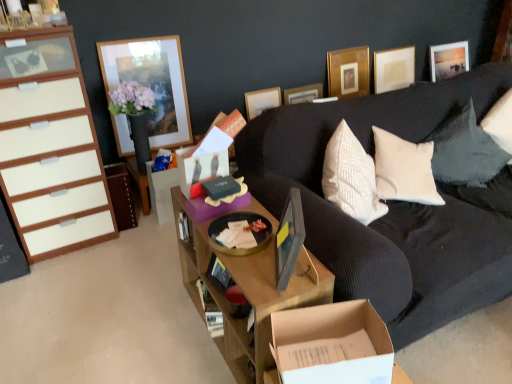
Question: Does matte gray picture frame at center, which ranks as the 6th picture frame in back-to-front order, have a larger size compared to gold metallic picture frame at upper center, acting as the 4th picture frame starting from the front?

Choices:
 (A) no
 (B) yes

Answer: (A)

Question: From the image's perspective, is matte gray picture frame at center, the 1th picture frame in the front-to-back sequence, located above gold metallic picture frame at upper center, which is the third picture frame from back to front?

Choices:
 (A) yes
 (B) no

Answer: (B)

Question: Is matte gray picture frame at center, which ranks as the 6th picture frame in back-to-front order, in contact with gold metallic picture frame at upper center, which is the third picture frame from back to front?

Choices:
 (A) no
 (B) yes

Answer: (A)

Question: Is matte gray picture frame at center, the 3th picture frame when ordered from left to right, far from gold metallic picture frame at upper center, the fourth picture frame when ordered from left to right?

Choices:
 (A) no
 (B) yes

Answer: (B)

Question: Does matte gray picture frame at center, the fourth picture frame in the right-to-left sequence, have a lesser height compared to gold metallic picture frame at upper center, which is the third picture frame from back to front?

Choices:
 (A) yes
 (B) no

Answer: (A)

Question: From the image's perspective, would you say matte gray picture frame at center, the 1th picture frame in the front-to-back sequence, is shown under gold metallic picture frame at upper center, which is the third picture frame from back to front?

Choices:
 (A) no
 (B) yes

Answer: (B)

Question: Is white glossy cabinet at left, the 1th cabinetry when ordered from left to right, taller than wooden picture frame at upper left, marked as the first picture frame in a left-to-right arrangement?

Choices:
 (A) yes
 (B) no

Answer: (A)

Question: From the image's perspective, is white glossy cabinet at left, acting as the second cabinetry starting from the right, on top of wooden picture frame at upper left, acting as the 6th picture frame starting from the right?

Choices:
 (A) yes
 (B) no

Answer: (B)

Question: From a real-world perspective, does white glossy cabinet at left, acting as the second cabinetry starting from the right, sit lower than wooden picture frame at upper left, acting as the 6th picture frame starting from the right?

Choices:
 (A) yes
 (B) no

Answer: (A)

Question: Considering the relative sizes of white glossy cabinet at left, the 1th cabinetry when ordered from left to right, and wooden picture frame at upper left, marked as the first picture frame in a left-to-right arrangement, in the image provided, is white glossy cabinet at left, the 1th cabinetry when ordered from left to right, smaller than wooden picture frame at upper left, marked as the first picture frame in a left-to-right arrangement,?

Choices:
 (A) no
 (B) yes

Answer: (A)

Question: Is white glossy cabinet at left, acting as the second cabinetry starting from the right, positioned beyond the bounds of wooden picture frame at upper left, acting as the 6th picture frame starting from the right?

Choices:
 (A) yes
 (B) no

Answer: (A)

Question: Can you confirm if white glossy cabinet at left, acting as the second cabinetry starting from the right, is wider than wooden picture frame at upper left, marked as the first picture frame in a left-to-right arrangement?

Choices:
 (A) yes
 (B) no

Answer: (A)

Question: Would you consider wooden picture frame at upper left, marked as the first picture frame in a left-to-right arrangement, to be distant from black textured pillow at upper right?

Choices:
 (A) no
 (B) yes

Answer: (B)